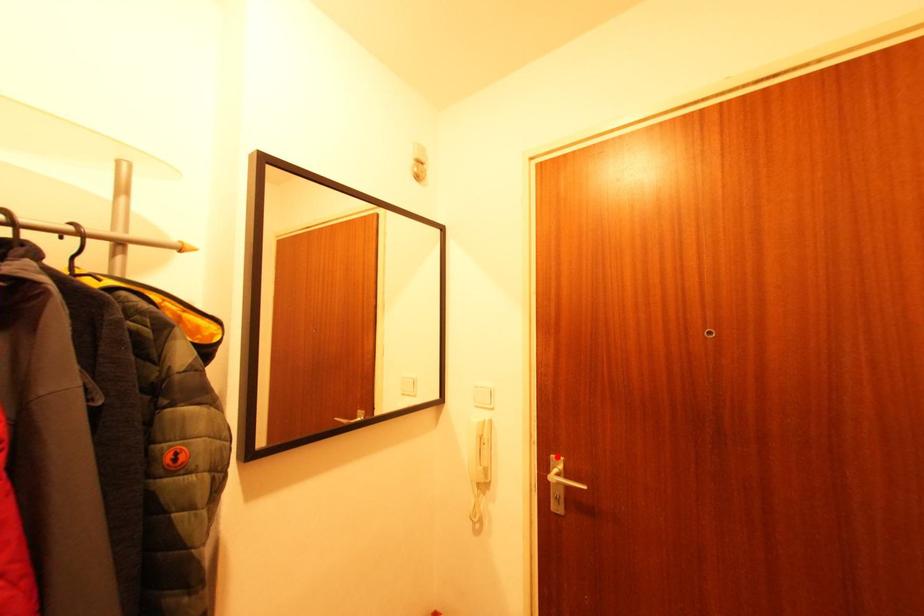
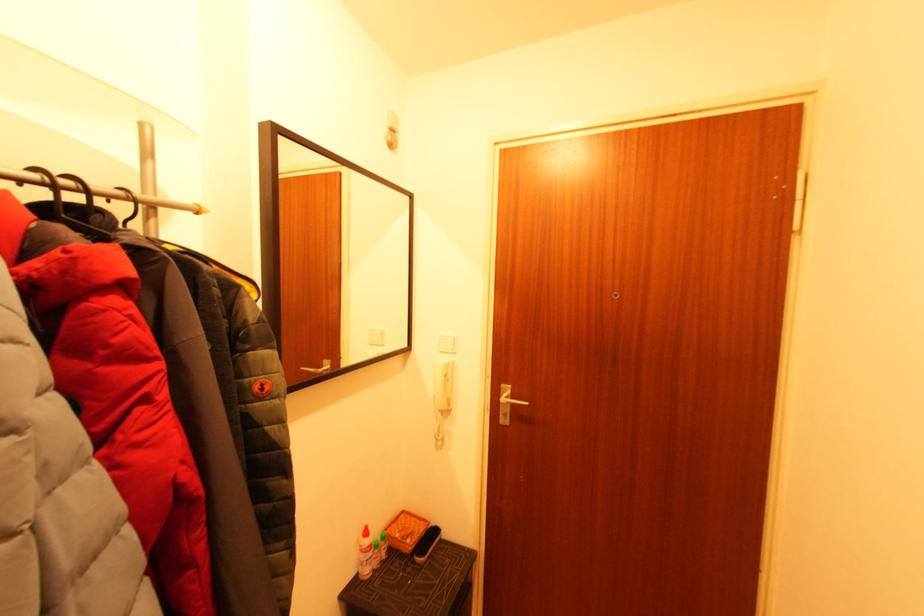
Where in the second image is the point corresponding to the highlighted location from the first image?

(506, 387)